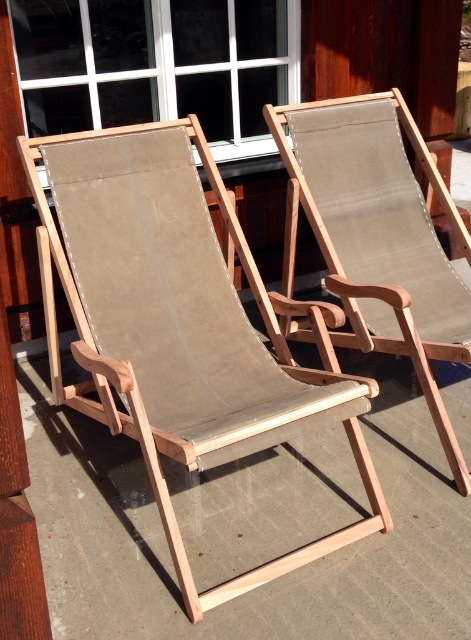
Question: Which point is closer to the camera?

Choices:
 (A) (462, 460)
 (B) (206, 304)

Answer: (A)

Question: From the image, what is the correct spatial relationship of natural wood beach chair at center in relation to matte brown fabric chair at center?

Choices:
 (A) right
 (B) left

Answer: (B)

Question: Can you confirm if natural wood beach chair at center is bigger than matte brown fabric chair at center?

Choices:
 (A) no
 (B) yes

Answer: (B)

Question: Which object appears closest to the camera in this image?

Choices:
 (A) natural wood beach chair at center
 (B) matte brown fabric chair at center

Answer: (A)

Question: In this image, where is natural wood beach chair at center located relative to matte brown fabric chair at center?

Choices:
 (A) below
 (B) above

Answer: (A)